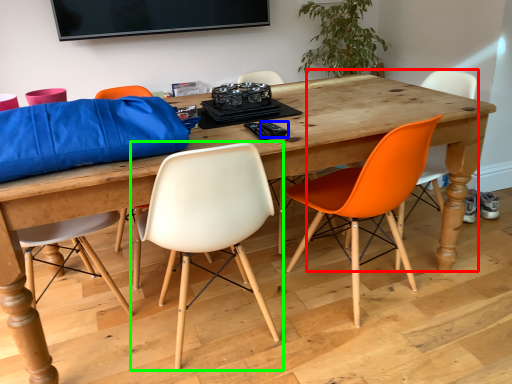
Question: Considering the real-world distances, which object is closest to chair (highlighted by a red box)? remote control (highlighted by a blue box) or chair (highlighted by a green box).

Choices:
 (A) remote control
 (B) chair

Answer: (A)